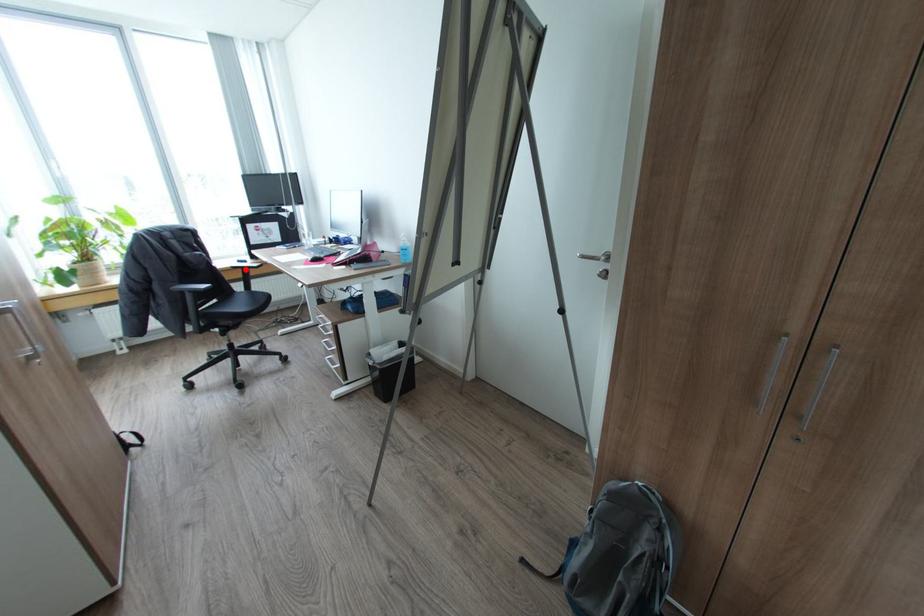
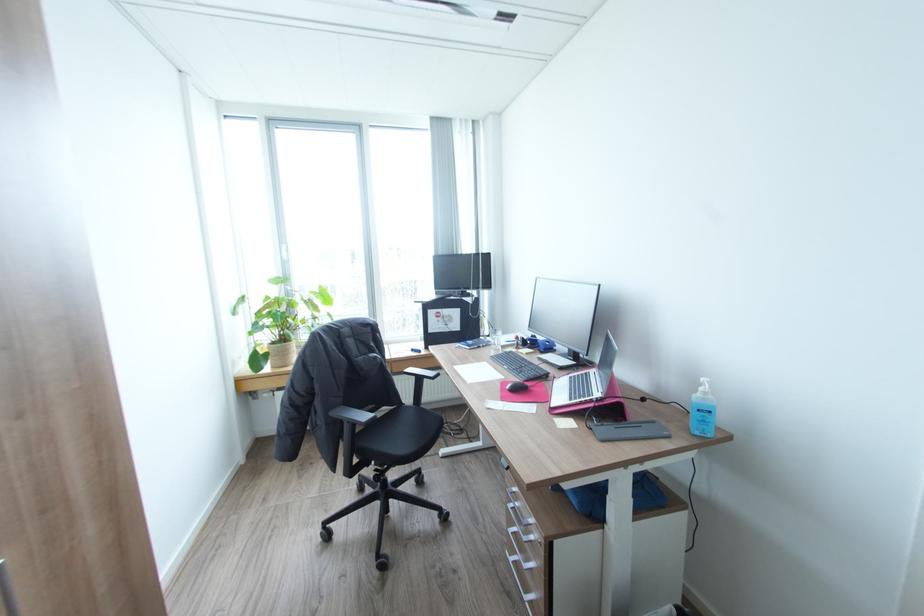
The point at the highlighted location is marked in the first image. Where is the corresponding point in the second image?

(419, 378)